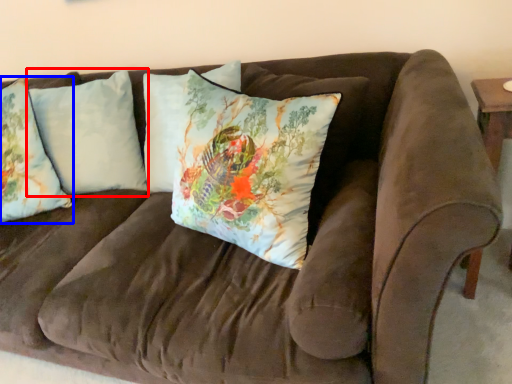
Question: Which object appears farthest to the camera in this image, pillow (highlighted by a red box) or pillow (highlighted by a blue box)?

Choices:
 (A) pillow
 (B) pillow

Answer: (A)